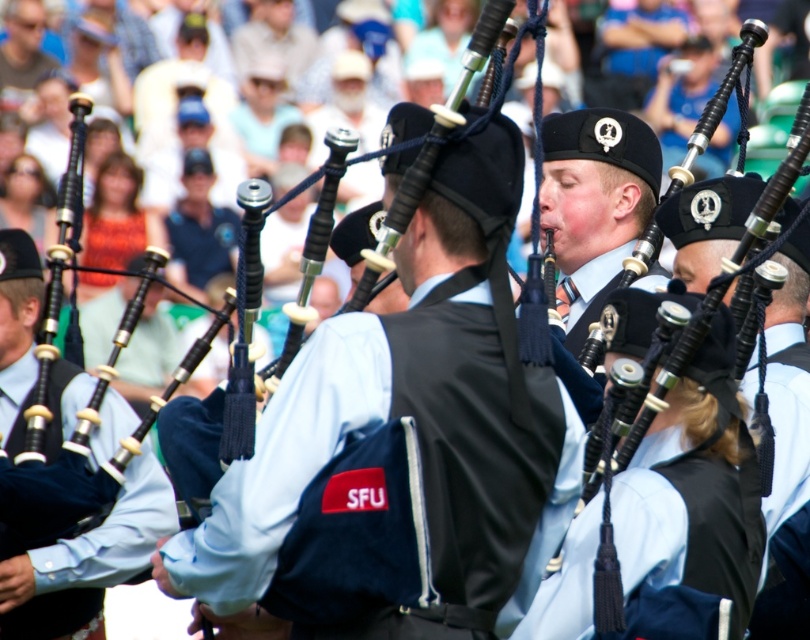
Question: Is matte black vest at center smaller than matte black bagpipes at center?

Choices:
 (A) no
 (B) yes

Answer: (B)

Question: Does matte black vest at center have a larger size compared to matte black bagpipes at center?

Choices:
 (A) no
 (B) yes

Answer: (A)

Question: Which of the following is the closest to the observer?

Choices:
 (A) matte black bagpipes at center
 (B) matte black vest at center

Answer: (B)

Question: Observing the image, what is the correct spatial positioning of matte black vest at center in reference to matte black bagpipes at center?

Choices:
 (A) below
 (B) above

Answer: (B)